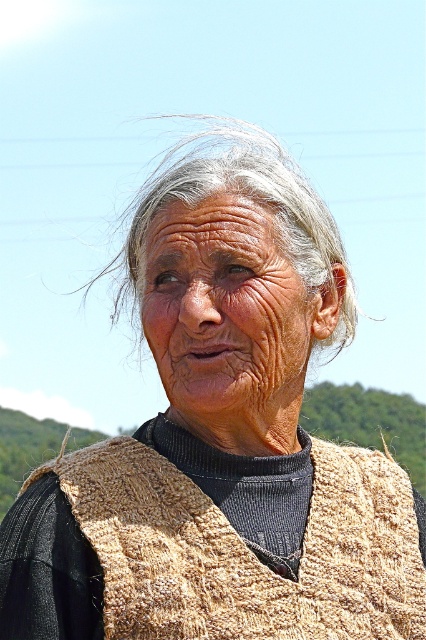
You are an artist sketching the elderly person in the image. You need to decide the order to draw the knitted beige shawl at center and the gray woolen hair at center based on their position. Which should you draw first?

The knitted beige shawl at center is located below the gray woolen hair at center, so you should draw the gray woolen hair at center first as it is positioned above the shawl.

You are an artist trying to sketch this person. You notice two items at the center of the image. Which one is narrower between the knitted beige shawl at center and the gray woolen hair at center?

The knitted beige shawl at center is narrower than the gray woolen hair at center.